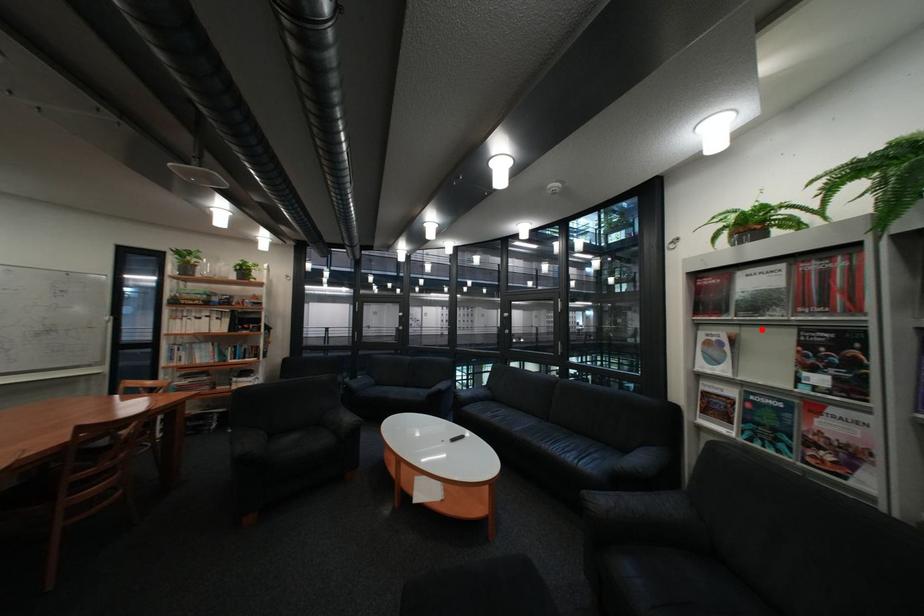
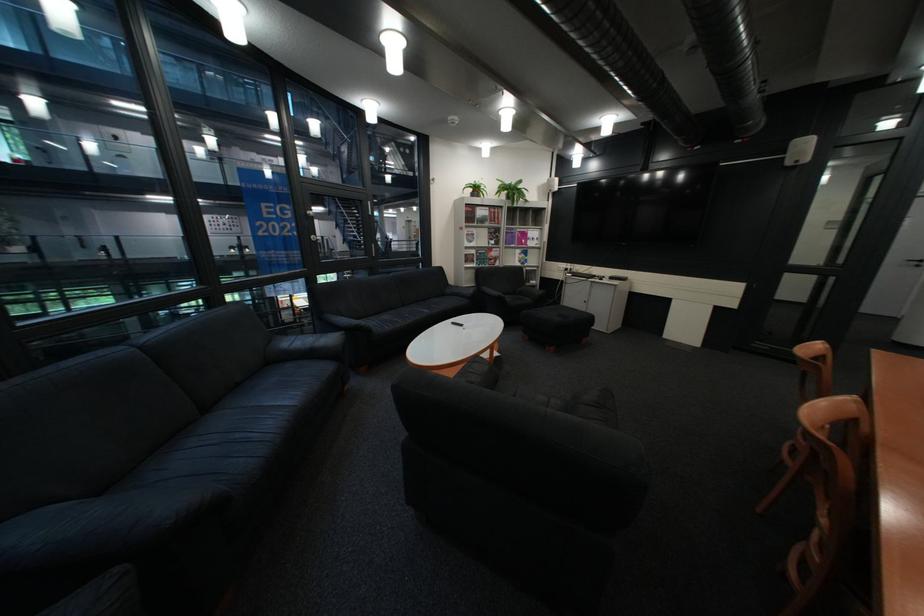
Question: A red point is marked in image1. In image2, is the corresponding 3D point closer to the camera or farther? Reply with the corresponding letter.

Choices:
 (A) The corresponding 3D point is closer.
 (B) The corresponding 3D point is farther.

Answer: (A)